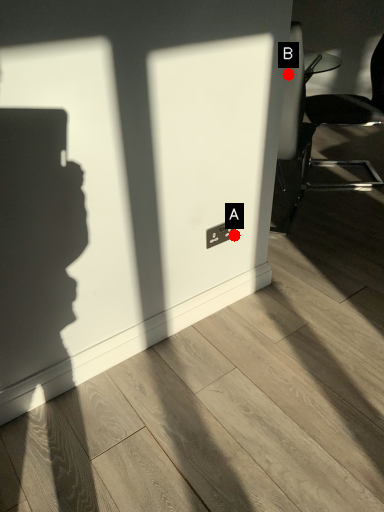
Question: Two points are circled on the image, labeled by A and B beside each circle. Which of the following is the closest to the observer?

Choices:
 (A) A is closer
 (B) B is closer

Answer: (A)